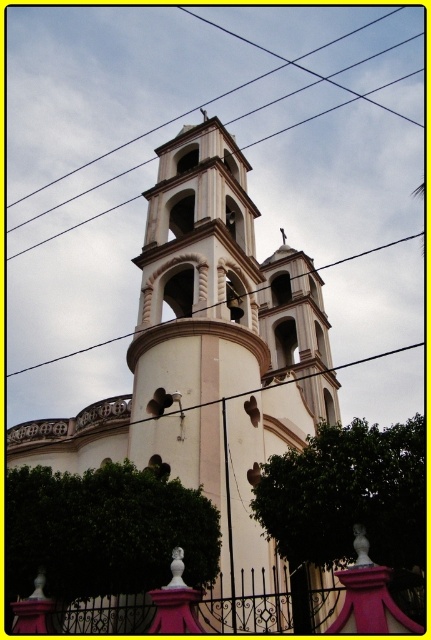
Who is taller, black wire at upper center or black wire at center?

Standing taller between the two is black wire at upper center.

Who is more distant from viewer, (199, 16) or (46, 240)?

Point (199, 16)

I want to click on black wire at upper center, so click(x=212, y=97).